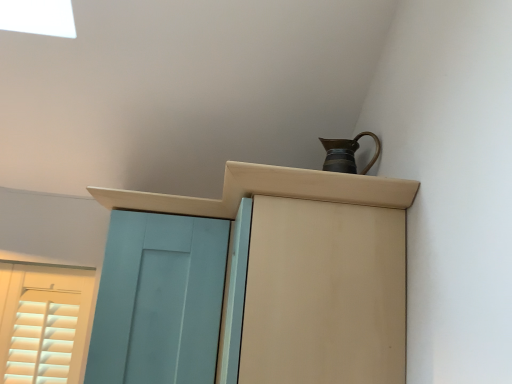
Question: From the image's perspective, is teal matte door at left below matte brown cupboard at upper right?

Choices:
 (A) no
 (B) yes

Answer: (B)

Question: From a real-world perspective, is teal matte door at left over matte brown cupboard at upper right?

Choices:
 (A) no
 (B) yes

Answer: (A)

Question: Is teal matte door at left positioned with its back to matte brown cupboard at upper right?

Choices:
 (A) yes
 (B) no

Answer: (A)

Question: Is teal matte door at left not inside matte brown cupboard at upper right?

Choices:
 (A) no
 (B) yes

Answer: (A)

Question: Is teal matte door at left closer to camera compared to matte brown cupboard at upper right?

Choices:
 (A) yes
 (B) no

Answer: (B)

Question: Can you confirm if teal matte door at left is shorter than matte brown cupboard at upper right?

Choices:
 (A) no
 (B) yes

Answer: (B)

Question: Is metallic brown jug at upper right turned away from teal matte door at left?

Choices:
 (A) no
 (B) yes

Answer: (A)

Question: Can you confirm if metallic brown jug at upper right is smaller than teal matte door at left?

Choices:
 (A) no
 (B) yes

Answer: (B)

Question: Considering the relative positions of metallic brown jug at upper right and teal matte door at left in the image provided, is metallic brown jug at upper right to the left of teal matte door at left from the viewer's perspective?

Choices:
 (A) yes
 (B) no

Answer: (B)

Question: Can teal matte door at left be found inside metallic brown jug at upper right?

Choices:
 (A) no
 (B) yes

Answer: (A)

Question: Is the depth of metallic brown jug at upper right greater than that of teal matte door at left?

Choices:
 (A) yes
 (B) no

Answer: (A)

Question: Considering the relative positions of metallic brown jug at upper right and teal matte door at left in the image provided, is metallic brown jug at upper right in front of teal matte door at left?

Choices:
 (A) yes
 (B) no

Answer: (B)

Question: From the image's perspective, is matte wood cabinet at upper center on top of teal matte door at left?

Choices:
 (A) yes
 (B) no

Answer: (A)